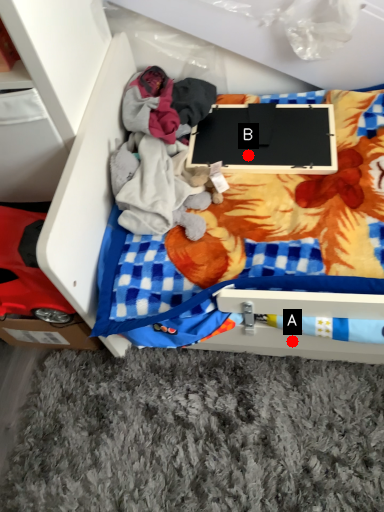
Question: Two points are circled on the image, labeled by A and B beside each circle. Which point is closer to the camera?

Choices:
 (A) A is closer
 (B) B is closer

Answer: (A)